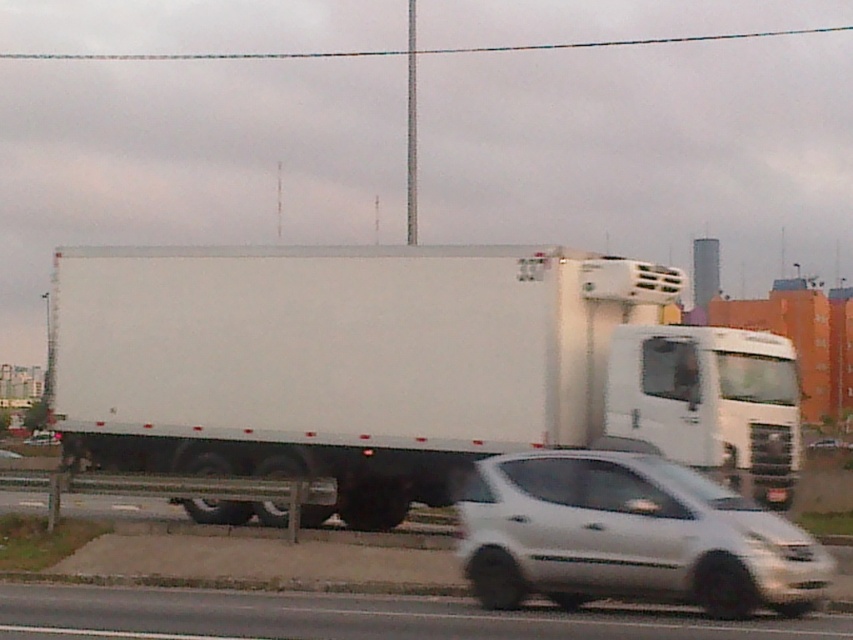
Can you confirm if white glossy car at lower center is positioned to the left of black plastic license plate at center?

Yes, white glossy car at lower center is to the left of black plastic license plate at center.

At what (x,y) coordinates should I click in order to perform the action: click on white glossy car at lower center. Please return your answer as a coordinate pair (x, y). The width and height of the screenshot is (853, 640). Looking at the image, I should click on (357, 618).

Which is in front, point (76, 628) or point (785, 486)?

Point (76, 628) is more forward.

This screenshot has height=640, width=853. Find the location of `white glossy car at lower center`. white glossy car at lower center is located at coordinates (357, 618).

Can you confirm if white matte truck at center is positioned to the right of white glossy car at lower center?

Indeed, white matte truck at center is positioned on the right side of white glossy car at lower center.

Between white matte truck at center and white glossy car at lower center, which one is positioned lower?

white glossy car at lower center is lower down.

Which is behind, point (701, 356) or point (1, 628)?

Positioned behind is point (701, 356).

Find the location of `white matte truck at center`. white matte truck at center is located at coordinates (402, 368).

Looking at this image, is white matte car at lower right thinner than black plastic license plate at center?

Incorrect, white matte car at lower right's width is not less than black plastic license plate at center's.

Based on the photo, is white matte car at lower right taller than black plastic license plate at center?

Yes.

Find the location of a particular element. The width and height of the screenshot is (853, 640). white matte car at lower right is located at coordinates (628, 536).